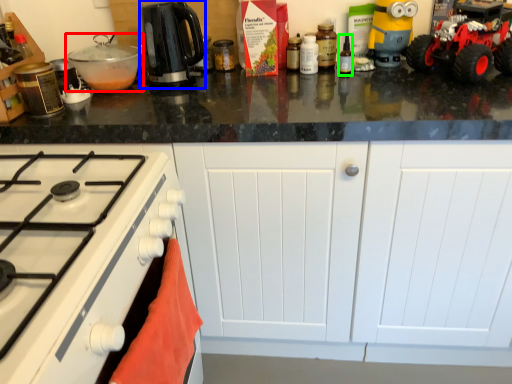
Question: Considering the real-world distances, which object is farthest from kitchen appliance (highlighted by a red box)? kitchen appliance (highlighted by a blue box) or bottle (highlighted by a green box)?

Choices:
 (A) kitchen appliance
 (B) bottle

Answer: (B)